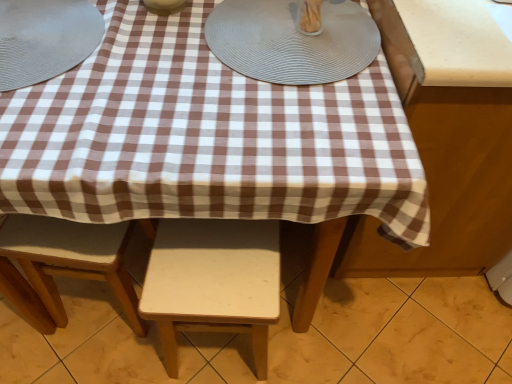
You are a GUI agent. You are given a task and a screenshot of the screen. Output one action in this format:
    pyautogui.click(x=<x>, y=<y>)
    Task: Click on the vacant area to the right of white matte stool at center, which ranks as the 2th stool in left-to-right order
    This screenshot has width=512, height=384.
    Given the screenshot: What is the action you would take?
    pyautogui.click(x=315, y=339)